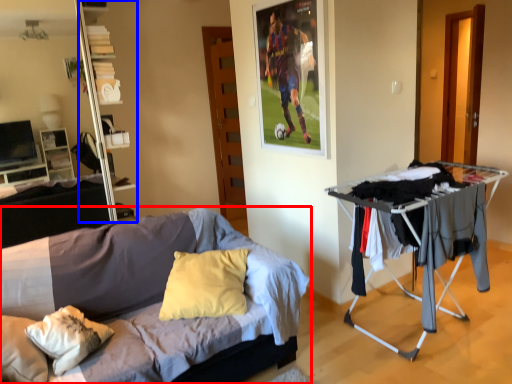
Question: Among these objects, which one is nearest to the camera, bed (highlighted by a red box) or shelf (highlighted by a blue box)?

Choices:
 (A) bed
 (B) shelf

Answer: (A)